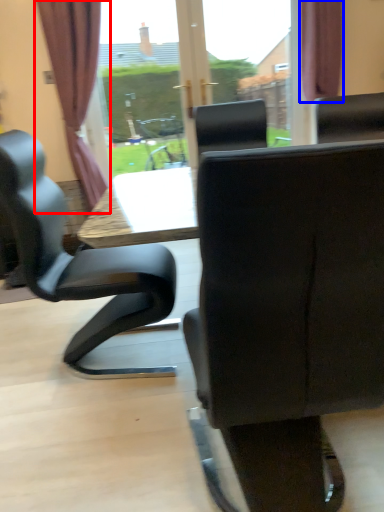
Question: Among these objects, which one is nearest to the camera, curtain (highlighted by a red box) or curtain (highlighted by a blue box)?

Choices:
 (A) curtain
 (B) curtain

Answer: (A)